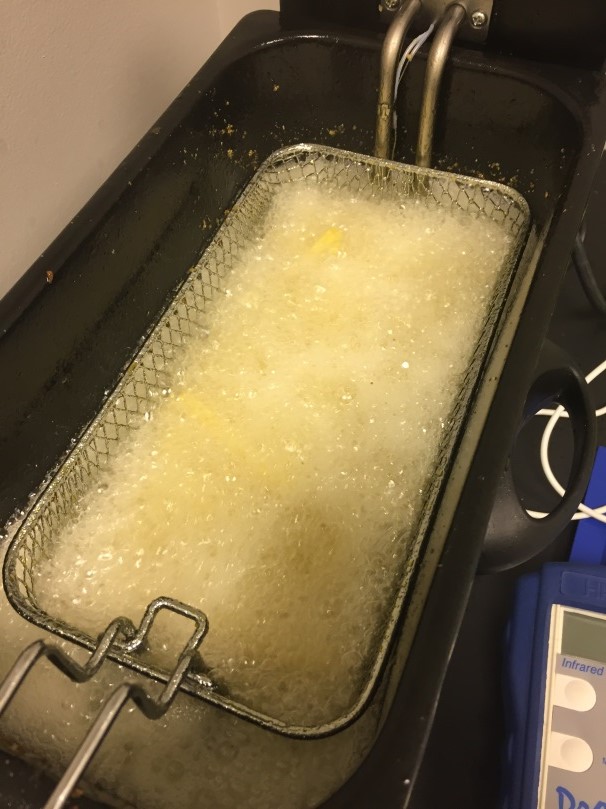
Where is `handle`? handle is located at coordinates (582, 404).